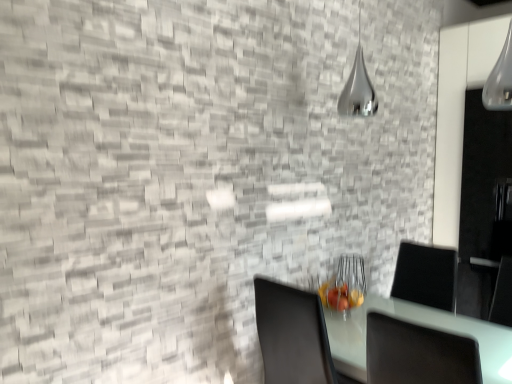
Question: From a real-world perspective, is silver metallic lamp at upper center physically below white glossy table at lower right?

Choices:
 (A) no
 (B) yes

Answer: (A)

Question: Considering the relative positions of silver metallic lamp at upper center and white glossy table at lower right in the image provided, is silver metallic lamp at upper center to the left of white glossy table at lower right from the viewer's perspective?

Choices:
 (A) yes
 (B) no

Answer: (A)

Question: Is white glossy table at lower right inside silver metallic lamp at upper center?

Choices:
 (A) no
 (B) yes

Answer: (A)

Question: Could you tell me if silver metallic lamp at upper center is facing white glossy table at lower right?

Choices:
 (A) yes
 (B) no

Answer: (B)

Question: Does silver metallic lamp at upper center come in front of white glossy table at lower right?

Choices:
 (A) no
 (B) yes

Answer: (A)

Question: Is silver metallic lamp at upper center bigger than white glossy table at lower right?

Choices:
 (A) yes
 (B) no

Answer: (B)

Question: Is transparent glass door at right aimed at silver metallic lamp at upper center?

Choices:
 (A) yes
 (B) no

Answer: (A)

Question: From a real-world perspective, does transparent glass door at right sit lower than silver metallic lamp at upper center?

Choices:
 (A) no
 (B) yes

Answer: (B)

Question: From a real-world perspective, is transparent glass door at right physically above silver metallic lamp at upper center?

Choices:
 (A) no
 (B) yes

Answer: (A)

Question: From the image's perspective, is transparent glass door at right on silver metallic lamp at upper center?

Choices:
 (A) no
 (B) yes

Answer: (A)

Question: Would you consider transparent glass door at right to be distant from silver metallic lamp at upper center?

Choices:
 (A) no
 (B) yes

Answer: (A)

Question: Does transparent glass door at right have a lesser height compared to silver metallic lamp at upper center?

Choices:
 (A) yes
 (B) no

Answer: (B)

Question: From the image's perspective, is transparent glass door at right located beneath white glossy table at lower right?

Choices:
 (A) yes
 (B) no

Answer: (B)